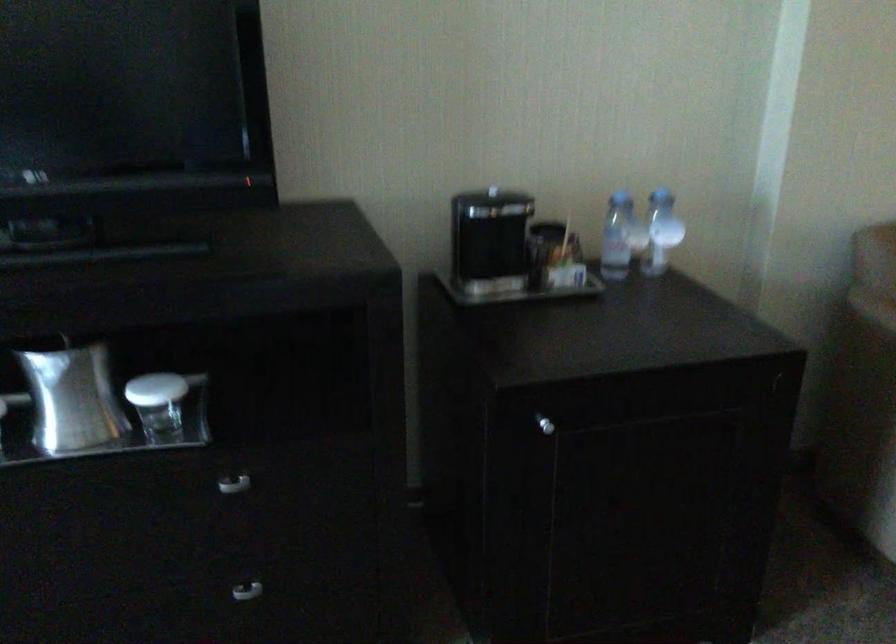
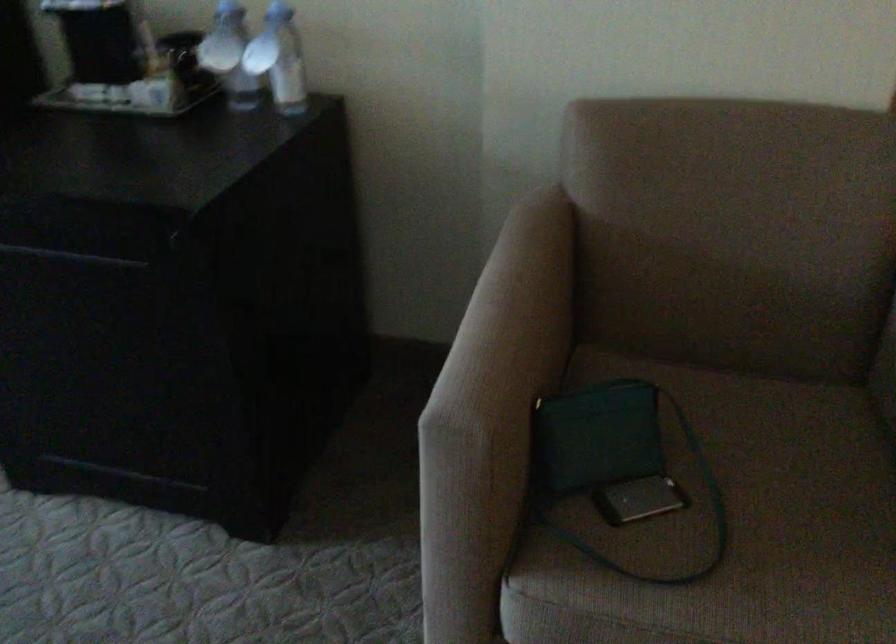
Find the pixel in the second image that matches the point at 659,230 in the first image.

(279, 59)